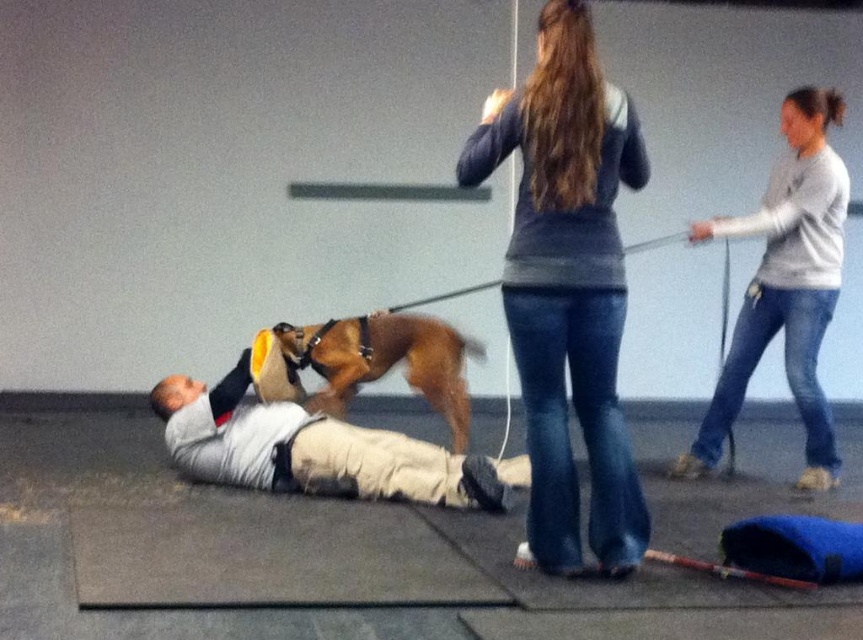
Is point (602, 472) positioned in front of point (295, 461)?

Yes, point (602, 472) is in front of point (295, 461).

The width and height of the screenshot is (863, 640). What do you see at coordinates (567, 285) in the screenshot?
I see `gray sweater at center` at bounding box center [567, 285].

Between point (565, 77) and point (450, 483), which one is positioned behind?

The point (450, 483) is behind.

Locate an element on the screen. gray sweater at center is located at coordinates tap(567, 285).

Looking at this image, can you confirm if gray sweater at center is positioned to the left of gray cotton shirt at upper right?

Indeed, gray sweater at center is positioned on the left side of gray cotton shirt at upper right.

Does point (526, 244) lie behind point (809, 364)?

No.

At what (x,y) coordinates should I click in order to perform the action: click on gray sweater at center. Please return your answer as a coordinate pair (x, y). The width and height of the screenshot is (863, 640). Looking at the image, I should click on (567, 285).

Between light gray fabric shirt at center and brown leather dog at center, which one has more height?

With more height is brown leather dog at center.

Can you confirm if light gray fabric shirt at center is thinner than brown leather dog at center?

In fact, light gray fabric shirt at center might be wider than brown leather dog at center.

Based on the photo, who is more distant from viewer, (521, 456) or (301, 346)?

Positioned behind is point (521, 456).

Locate an element on the screen. This screenshot has width=863, height=640. light gray fabric shirt at center is located at coordinates (316, 449).